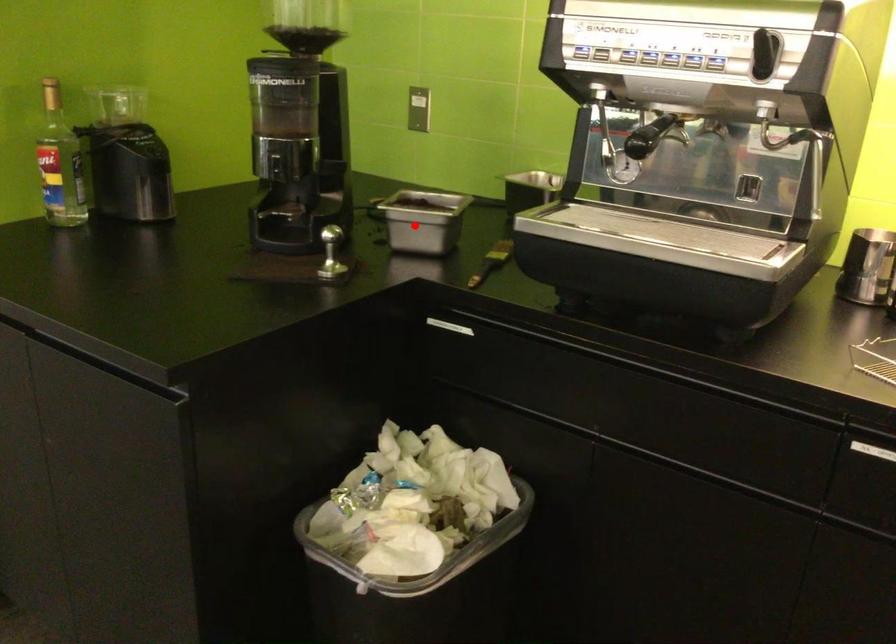
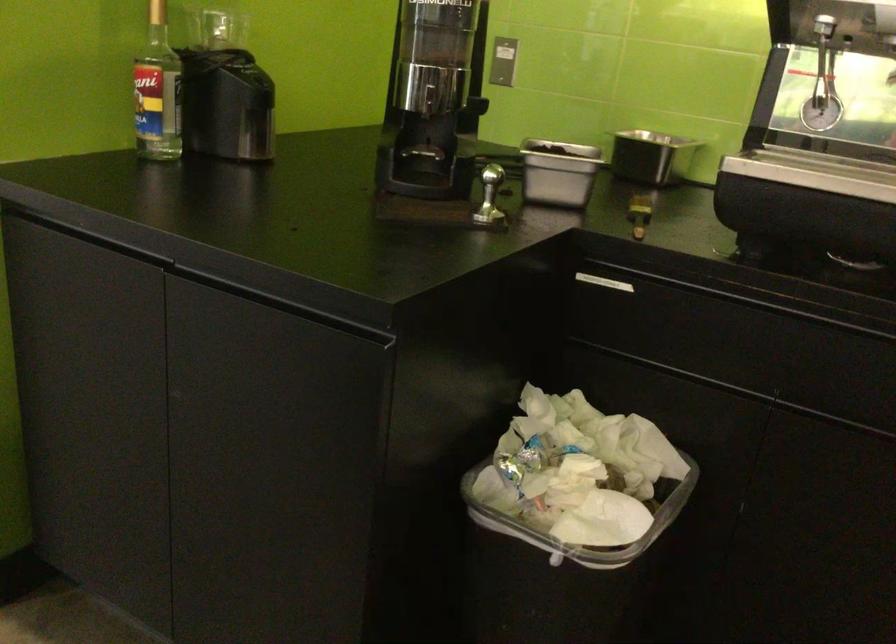
Question: I am providing you with two images of the same scene from different viewpoints. In image1, a red point is highlighted. Considering the same 3D point in image2, which of the following is correct?

Choices:
 (A) It is closer
 (B) It is farther

Answer: (A)